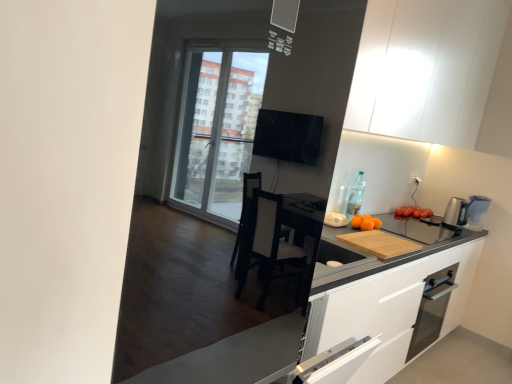
What do you see at coordinates (355, 196) in the screenshot? I see `clear glass bottle at upper right` at bounding box center [355, 196].

What is the approximate height of clear glass bottle at upper right?

The height of clear glass bottle at upper right is 33.84 centimeters.

This screenshot has width=512, height=384. What do you see at coordinates (465, 212) in the screenshot?
I see `silver metallic coffee machine at right` at bounding box center [465, 212].

This screenshot has height=384, width=512. What do you see at coordinates (432, 309) in the screenshot?
I see `glass door oven at lower right` at bounding box center [432, 309].

Locate an element on the screen. The width and height of the screenshot is (512, 384). wooden cutting board at right is located at coordinates (416, 229).

Looking at this image, in order to face wooden cutting board at right, should I rotate leftwards or rightwards?

To face it directly, rotate right by 19.192 degrees.

You are a GUI agent. You are given a task and a screenshot of the screen. Output one action in this format:
    pyautogui.click(x=<x>, y=<y>)
    Task: Click on the clear glass bottle at upper right
    Image resolution: width=512 pixels, height=384 pixels.
    Given the screenshot: What is the action you would take?
    pyautogui.click(x=355, y=196)

Considering the positions of objects white matte cabinet at upper center and wooden cutting board at right in the image provided, who is behind, white matte cabinet at upper center or wooden cutting board at right?

Positioned behind is wooden cutting board at right.

Considering the positions of objects white matte cabinet at upper center and wooden cutting board at right in the image provided, who is more to the right, white matte cabinet at upper center or wooden cutting board at right?

From the viewer's perspective, wooden cutting board at right appears more on the right side.

Is white matte cabinet at upper center taller than wooden cutting board at right?

Correct, white matte cabinet at upper center is much taller as wooden cutting board at right.

From the image's perspective, which is below, white matte cabinet at upper center or wooden cutting board at right?

wooden cutting board at right.

Considering the relative positions of wooden cutting board at right and orange matte at right in the image provided, is wooden cutting board at right to the left of orange matte at right from the viewer's perspective?

In fact, wooden cutting board at right is to the right of orange matte at right.

In the scene shown: Does wooden cutting board at right turn towards orange matte at right?

No.

Considering their positions, is wooden cutting board at right located in front of or behind orange matte at right?

Visually, wooden cutting board at right is located in front of orange matte at right.

Is orange matte at right a part of wooden cutting board at right?

No, wooden cutting board at right does not contain orange matte at right.

Considering the points (452, 277) and (460, 217), which point is behind, point (452, 277) or point (460, 217)?

The point (460, 217) is behind.

Looking at this image, between glass door oven at lower right and silver metallic coffee machine at right, which one has smaller width?

glass door oven at lower right.

From the image's perspective, is glass door oven at lower right above or below silver metallic coffee machine at right?

Based on their image positions, glass door oven at lower right is located beneath silver metallic coffee machine at right.

Could silver metallic coffee machine at right be considered to be inside glass door oven at lower right?

That's incorrect, silver metallic coffee machine at right is not inside glass door oven at lower right.

Is orange matte at right looking in the opposite direction of wooden cutting board at right?

No, orange matte at right is not facing away from wooden cutting board at right.

This screenshot has height=384, width=512. I want to click on orange on the left of the wooden cutting board at right, so click(365, 222).

Which object is wider, orange matte at right or wooden cutting board at right?

wooden cutting board at right.

Does orange matte at right appear on the right side of wooden cutting board at right?

No.

Is white matte cabinet at upper center located outside orange matte at right?

Yes.

What's the angular difference between white matte cabinet at upper center and orange matte at right's facing directions?

There is a 0.387-degree angle between the facing directions of white matte cabinet at upper center and orange matte at right.

Considering the relative sizes of white matte cabinet at upper center and orange matte at right in the image provided, is white matte cabinet at upper center taller than orange matte at right?

Yes.

Is point (380, 81) closer or farther from the camera than point (374, 220)?

Point (380, 81).

Which object is positioned more to the right, wooden cutting board at right or glass door oven at lower right?

glass door oven at lower right.

Considering the sizes of objects wooden cutting board at right and glass door oven at lower right in the image provided, who is thinner, wooden cutting board at right or glass door oven at lower right?

With smaller width is glass door oven at lower right.

At what (x,y) coordinates should I click in order to perform the action: click on countertop in front of the glass door oven at lower right. Please return your answer as a coordinate pair (x, y). Looking at the image, I should click on (181, 290).

Which of these two, wooden cutting board at right or white matte cabinet at upper center, is thinner?

Thinner between the two is white matte cabinet at upper center.

From the image's perspective, is wooden cutting board at right beneath white matte cabinet at upper center?

Yes.

In the image, there is a white matte cabinet at upper center. At what (x,y) coordinates should I click in order to perform the action: click on appliance below it (from the image's perspective). Please return your answer as a coordinate pair (x, y). Looking at the image, I should click on (416, 229).

From a real-world perspective, is wooden cutting board at right above or below white matte cabinet at upper center?

Clearly, from a real-world perspective, wooden cutting board at right is below white matte cabinet at upper center.

Where is `appliance located below the white matte cabinet at upper center (from the image's perspective)`? The height and width of the screenshot is (384, 512). appliance located below the white matte cabinet at upper center (from the image's perspective) is located at coordinates (416, 229).

The image size is (512, 384). I want to click on appliance below the orange matte at right (from a real-world perspective), so click(416, 229).

From the image, which object appears to be nearer to wooden cutting board at right, glass door oven at lower right or wooden cutting board at right?

Among the two, glass door oven at lower right is located nearer to wooden cutting board at right.

From the image, which object appears to be nearer to white matte cabinet at upper center, clear glass bottle at upper right or wooden cutting board at right?

clear glass bottle at upper right is closer to white matte cabinet at upper center.

Based on their spatial positions, is silver metallic coffee machine at right or glass door oven at lower right further from clear glass bottle at upper right?

silver metallic coffee machine at right is further to clear glass bottle at upper right.

Considering their positions, is wooden cutting board at right positioned closer to orange matte at right than glass door oven at lower right?

Based on the image, wooden cutting board at right appears to be nearer to orange matte at right.

Based on their spatial positions, is silver metallic coffee machine at right or wooden cutting board at right closer to wooden cutting board at right?

wooden cutting board at right is closer to wooden cutting board at right.

Looking at the image, which one is located closer to orange matte at right, white matte cabinet at upper center or clear glass bottle at upper right?

clear glass bottle at upper right is positioned closer to the anchor orange matte at right.

When comparing their distances from orange matte at right, does wooden cutting board at right or clear glass bottle at upper right seem further?

The object further to orange matte at right is wooden cutting board at right.

Looking at the image, which one is located closer to white matte cabinet at upper center, glass door oven at lower right or wooden cutting board at right?

wooden cutting board at right is closer to white matte cabinet at upper center.

Locate an element on the screen. The width and height of the screenshot is (512, 384). appliance located between wooden cutting board at right and clear glass bottle at upper right in the depth direction is located at coordinates (416, 229).

Identify the location of coffee machine between white matte cabinet at upper center and glass door oven at lower right from top to bottom. The height and width of the screenshot is (384, 512). (465, 212).

Find the location of a particular element. The width and height of the screenshot is (512, 384). appliance that lies between white matte cabinet at upper center and wooden cutting board at right from top to bottom is located at coordinates (416, 229).

Locate an element on the screen. kitchen appliance between wooden cutting board at right and silver metallic coffee machine at right in the horizontal direction is located at coordinates (432, 309).